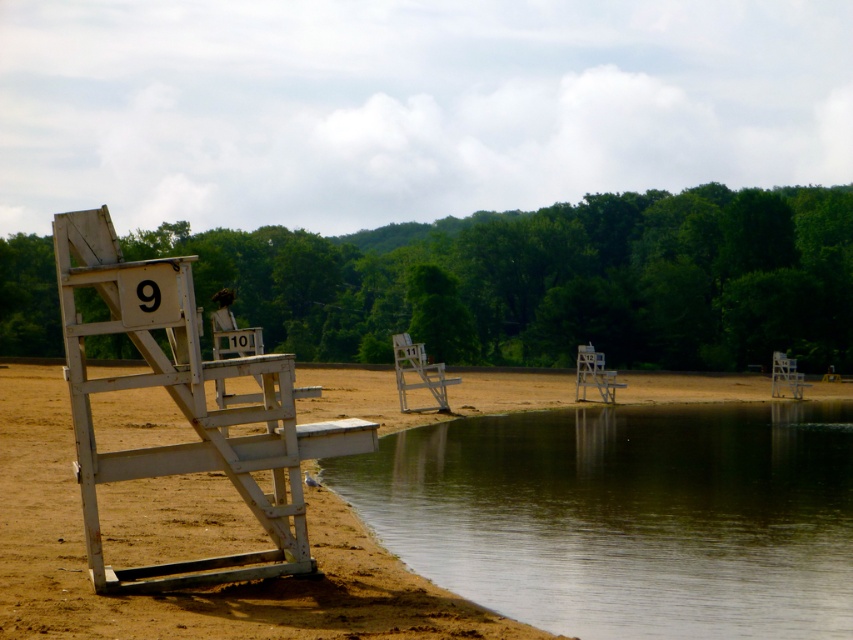
Between point (784, 634) and point (86, 458), which one is positioned in front?

Positioned in front is point (86, 458).

Is point (670, 532) less distant than point (138, 376)?

No, it is not.

Find the location of `clear water at lower center`. clear water at lower center is located at coordinates (625, 516).

Is clear water at lower center above white plastic chair at right?

Incorrect, clear water at lower center is not positioned above white plastic chair at right.

Between clear water at lower center and white plastic chair at right, which one has more height?

With more height is white plastic chair at right.

Identify the location of clear water at lower center. (625, 516).

Between brown sandy beach at lower left and white plastic chair at right, which one has less height?

With less height is brown sandy beach at lower left.

Does brown sandy beach at lower left have a larger size compared to white plastic chair at right?

Indeed, brown sandy beach at lower left has a larger size compared to white plastic chair at right.

Which is in front, point (550, 381) or point (779, 362)?

Point (779, 362)

Locate an element on the screen. brown sandy beach at lower left is located at coordinates (195, 588).